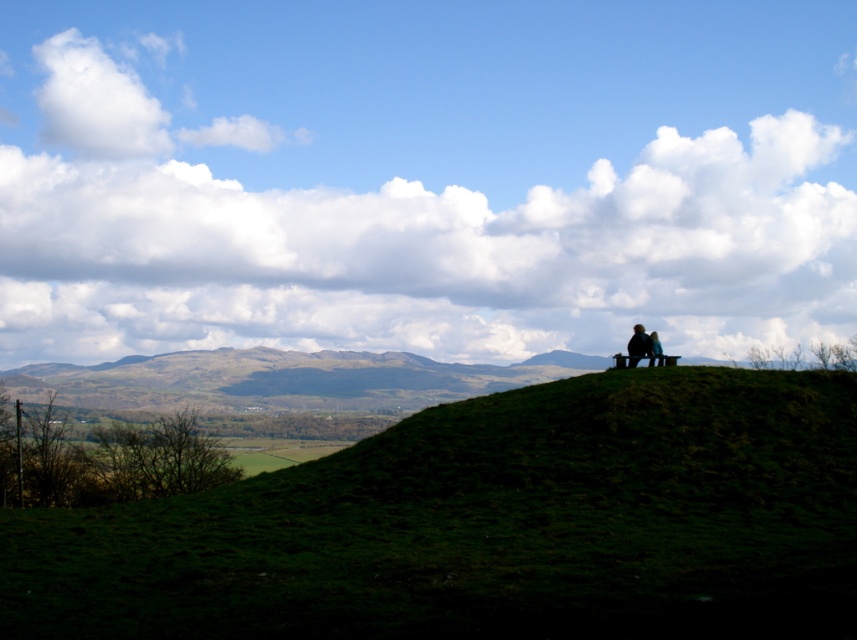
You are standing at the base of the green grassy hillside at upper center and want to walk to the silhouette wooden bench at upper right. Which direction should you go?

The green grassy hillside at upper center is closer to the viewer than the silhouette wooden bench at upper right, so you should walk towards the upper right direction to reach the silhouette wooden bench at upper right.

You are standing at the base of the green grassy hillside at upper center located at point (490, 525). You want to walk towards the two figures seated on the crest of the hill. Which direction should you head?

You should head towards the crest of the hill where the two figures are seated, as the green grassy hillside at upper center is located at point (490, 525), which is the direction leading upwards to the crest.

You are planning to set up a small tent for a picnic on the green grassy hillside at upper center. Considering the silhouette wooden bench at upper right, which object is higher in elevation?

The green grassy hillside at upper center is taller than the silhouette wooden bench at upper right, so the green grassy hillside at upper center is higher in elevation.